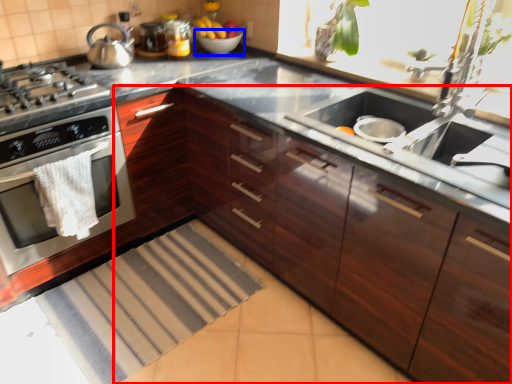
Question: Which point is closer to the camera, cabinetry (highlighted by a red box) or bowl (highlighted by a blue box)?

Choices:
 (A) cabinetry
 (B) bowl

Answer: (A)